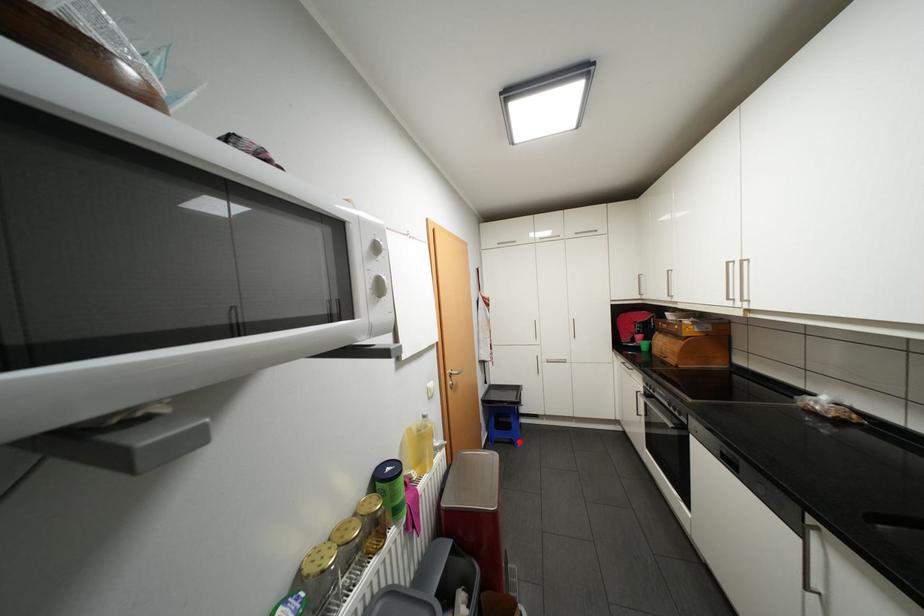
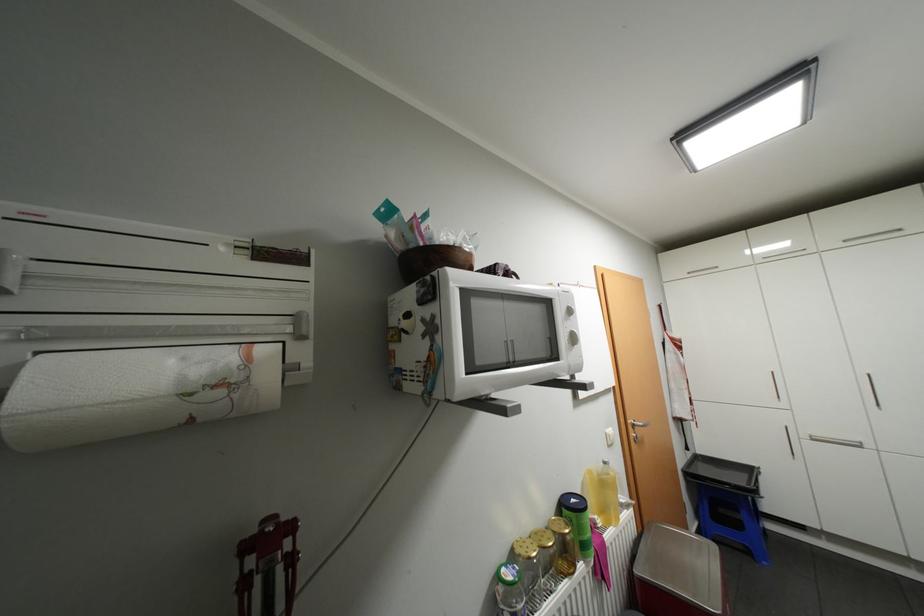
Question: I am providing you with two images of the same scene from different viewpoints. A red point is marked on the first image. Can you still see the location of the red point in image 2?

Choices:
 (A) Yes
 (B) No

Answer: (A)